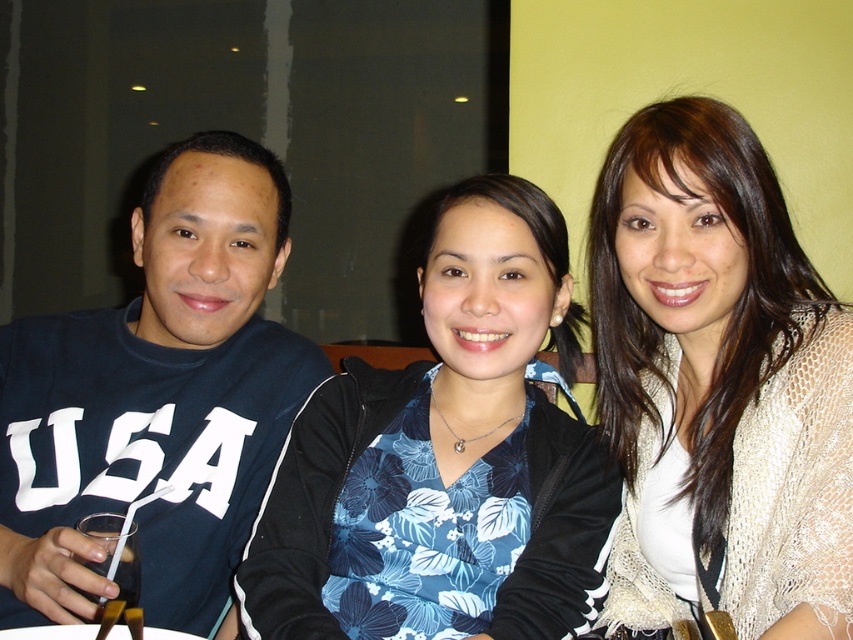
Question: Considering the real-world distances, which object is farthest from the blue floral blouse at center?

Choices:
 (A) clear plastic cup at lower left
 (B) blue fabric shirt at left
 (C) white lace shawl at center

Answer: (A)

Question: Which object appears farthest from the camera in this image?

Choices:
 (A) clear plastic cup at lower left
 (B) blue fabric shirt at left

Answer: (B)

Question: Is blue floral blouse at center above blue fabric shirt at left?

Choices:
 (A) yes
 (B) no

Answer: (B)

Question: Can you confirm if blue floral blouse at center is positioned to the right of clear plastic cup at lower left?

Choices:
 (A) no
 (B) yes

Answer: (B)

Question: Which is farther from the clear plastic cup at lower left?

Choices:
 (A) blue fabric shirt at left
 (B) blue floral blouse at center

Answer: (B)

Question: Does blue fabric shirt at left appear under clear plastic cup at lower left?

Choices:
 (A) no
 (B) yes

Answer: (A)